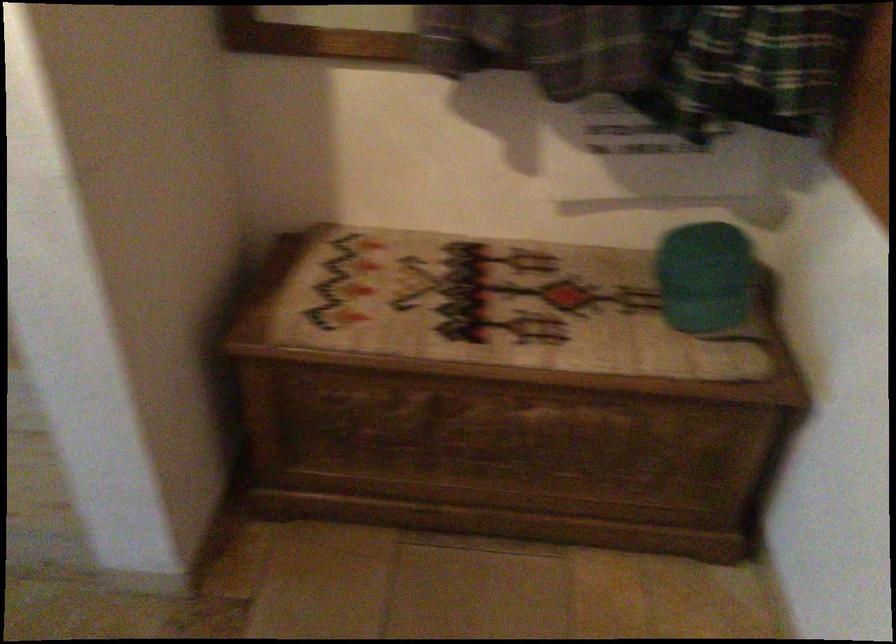
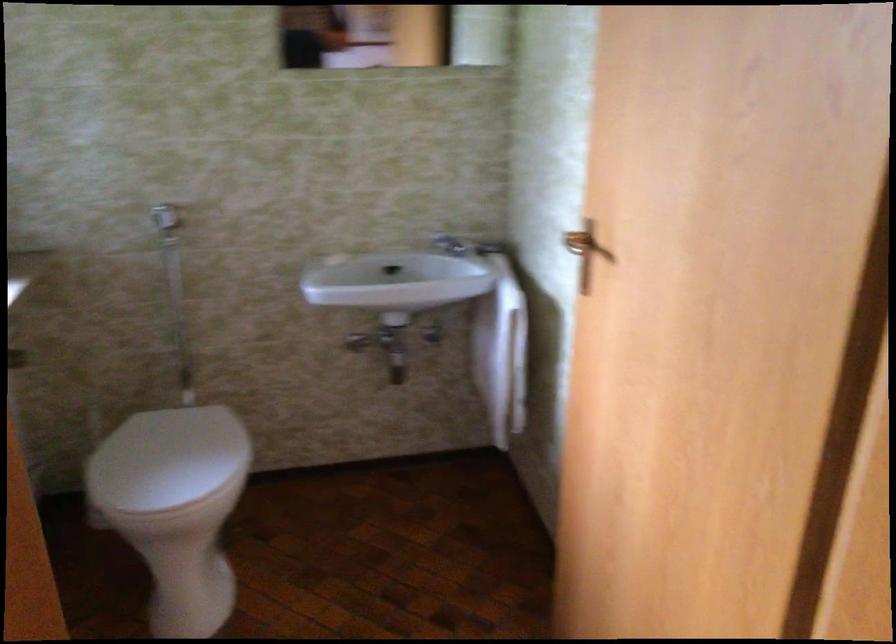
Question: The images are taken continuously from a first-person perspective. In which direction are you moving?

Choices:
 (A) Left
 (B) Right
 (C) Forward
 (D) Backward

Answer: (A)